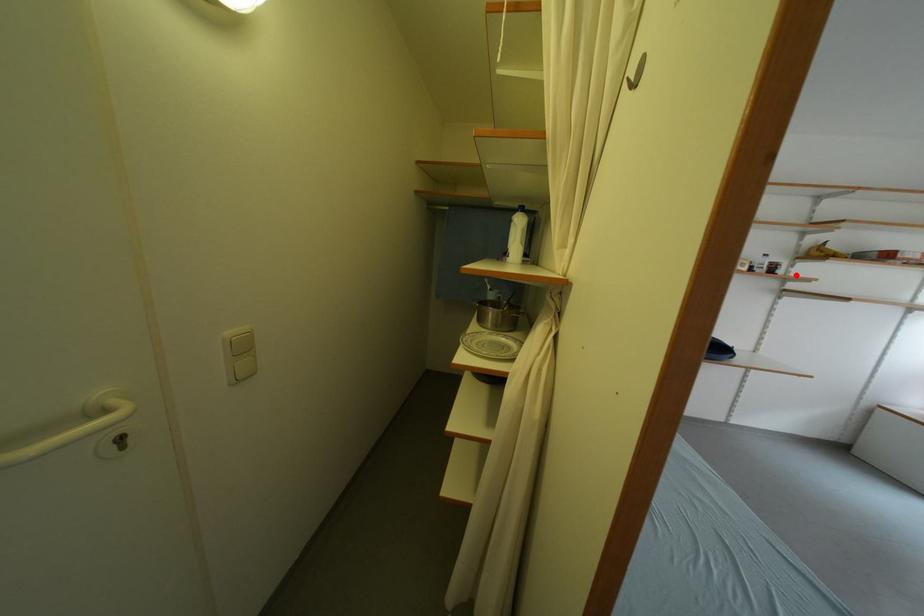
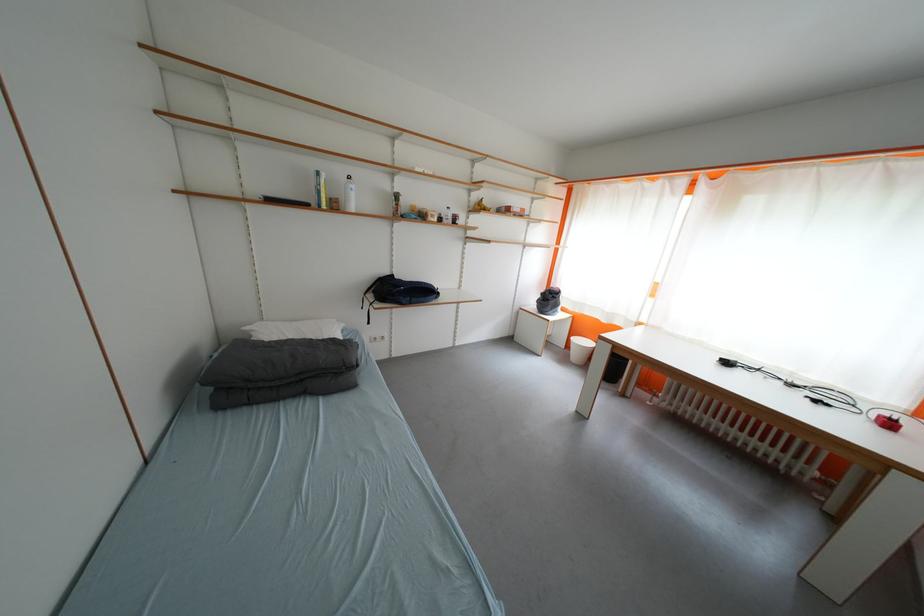
Question: I am providing you with two images of the same scene from different viewpoints. A red point is shown in image1. For the corresponding object point in image2, is it positioned nearer or farther from the camera?

Choices:
 (A) Nearer
 (B) Farther

Answer: (A)